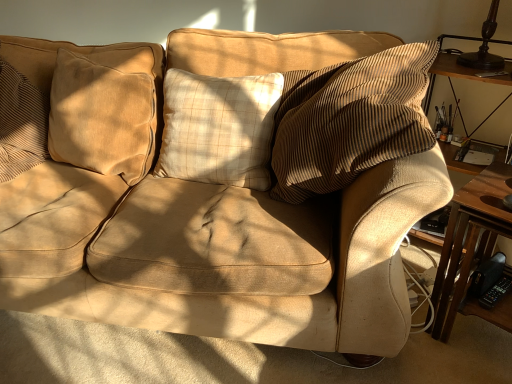
Question: Should I look upward or downward to see wooden table at right?

Choices:
 (A) up
 (B) down

Answer: (B)

Question: Is beige plaid pillow at center, which ranks as the second pillow in left-to-right order, taller than wooden table at right?

Choices:
 (A) yes
 (B) no

Answer: (B)

Question: Is beige plaid pillow at center, positioned as the 1th pillow in right-to-left order, positioned with its back to wooden table at right?

Choices:
 (A) no
 (B) yes

Answer: (A)

Question: Does beige plaid pillow at center, which ranks as the second pillow in left-to-right order, have a lesser width compared to wooden table at right?

Choices:
 (A) yes
 (B) no

Answer: (A)

Question: Does beige plaid pillow at center, which ranks as the second pillow in left-to-right order, contain wooden table at right?

Choices:
 (A) no
 (B) yes

Answer: (A)

Question: Considering the relative sizes of beige plaid pillow at center, which ranks as the second pillow in left-to-right order, and wooden table at right in the image provided, is beige plaid pillow at center, which ranks as the second pillow in left-to-right order, bigger than wooden table at right?

Choices:
 (A) yes
 (B) no

Answer: (B)

Question: Is beige plaid pillow at center, positioned as the 1th pillow in right-to-left order, not near wooden table at right?

Choices:
 (A) yes
 (B) no

Answer: (B)

Question: Does beige plaid pillow at center, which ranks as the second pillow in left-to-right order, have a smaller size compared to suede-like beige pillow at left, placed as the 2th pillow when sorted from right to left?

Choices:
 (A) no
 (B) yes

Answer: (A)

Question: From the image's perspective, is beige plaid pillow at center, positioned as the 1th pillow in right-to-left order, below suede-like beige pillow at left, placed as the 2th pillow when sorted from right to left?

Choices:
 (A) yes
 (B) no

Answer: (A)

Question: Could you tell me if beige plaid pillow at center, which ranks as the second pillow in left-to-right order, is turned towards suede-like beige pillow at left, placed as the 2th pillow when sorted from right to left?

Choices:
 (A) no
 (B) yes

Answer: (A)

Question: Is beige plaid pillow at center, positioned as the 1th pillow in right-to-left order, at the right side of suede-like beige pillow at left, marked as the 1th pillow in a left-to-right arrangement?

Choices:
 (A) no
 (B) yes

Answer: (B)

Question: Is beige plaid pillow at center, which ranks as the second pillow in left-to-right order, positioned in front of suede-like beige pillow at left, placed as the 2th pillow when sorted from right to left?

Choices:
 (A) no
 (B) yes

Answer: (A)

Question: Is suede-like beige pillow at left, placed as the 2th pillow when sorted from right to left, surrounded by beige plaid pillow at center, which ranks as the second pillow in left-to-right order?

Choices:
 (A) yes
 (B) no

Answer: (B)

Question: Could you tell me if wooden table at right is facing beige plaid pillow at center, which ranks as the second pillow in left-to-right order?

Choices:
 (A) yes
 (B) no

Answer: (B)